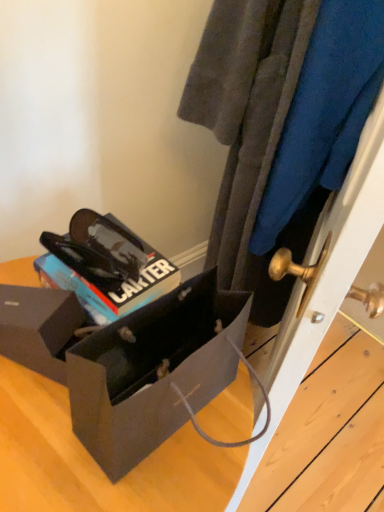
This screenshot has width=384, height=512. Describe the element at coordinates (39, 328) in the screenshot. I see `matte black box at lower left, which is counted as the first box, starting from the back` at that location.

Locate an element on the screen. Image resolution: width=384 pixels, height=512 pixels. matte black box at lower left, the second box when ordered from back to front is located at coordinates (129, 362).

Which is more to the right, matte black box at lower left, arranged as the 1th box when viewed from the front, or glossy black sunglasses at center?

glossy black sunglasses at center is more to the right.

From a real-world perspective, is matte black box at lower left, the second box when ordered from back to front, positioned over glossy black sunglasses at center based on gravity?

No, from a real-world perspective, matte black box at lower left, the second box when ordered from back to front, is not over glossy black sunglasses at center

Does matte black box at lower left, arranged as the 1th box when viewed from the front, turn towards glossy black sunglasses at center?

No, matte black box at lower left, arranged as the 1th box when viewed from the front, is not aimed at glossy black sunglasses at center.

Is there a large distance between matte black box at lower left, arranged as the 1th box when viewed from the front, and glossy black sunglasses at center?

matte black box at lower left, arranged as the 1th box when viewed from the front, is near glossy black sunglasses at center, not far away.

Would you say matte black box at lower left, positioned as the 2th box in front-to-back order, is to the left or to the right of matte black box at lower left, arranged as the 1th box when viewed from the front, in the picture?

Based on their positions, matte black box at lower left, positioned as the 2th box in front-to-back order, is located to the left of matte black box at lower left, arranged as the 1th box when viewed from the front.

Is matte black box at lower left, positioned as the 2th box in front-to-back order, positioned far away from matte black box at lower left, arranged as the 1th box when viewed from the front?

They are positioned close to each other.

Which object is further away from the camera, matte black box at lower left, positioned as the 2th box in front-to-back order, or matte black box at lower left, the second box when ordered from back to front?

matte black box at lower left, positioned as the 2th box in front-to-back order, is further away from the camera.

The width and height of the screenshot is (384, 512). What are the coordinates of `box located underneath the matte black box at lower left, positioned as the 2th box in front-to-back order (from a real-world perspective)` in the screenshot? It's located at (129, 362).

From a real-world perspective, is matte black box at lower left, positioned as the 2th box in front-to-back order, located higher than velvety blue sweater at center?

No.

Between matte black box at lower left, which is counted as the first box, starting from the back, and velvety blue sweater at center, which one appears on the left side from the viewer's perspective?

Positioned to the left is matte black box at lower left, which is counted as the first box, starting from the back.

Looking at this image, is the surface of matte black box at lower left, positioned as the 2th box in front-to-back order, in direct contact with velvety blue sweater at center?

matte black box at lower left, positioned as the 2th box in front-to-back order, and velvety blue sweater at center are clearly separated.

Which of these two, matte black box at lower left, which is counted as the first box, starting from the back, or velvety blue sweater at center, is wider?

Wider between the two is velvety blue sweater at center.

Is matte black box at lower left, which is counted as the first box, starting from the back, turned away from glossy black sunglasses at center?

No, matte black box at lower left, which is counted as the first box, starting from the back,'s orientation is not away from glossy black sunglasses at center.

How far apart are matte black box at lower left, which is counted as the first box, starting from the back, and glossy black sunglasses at center?

matte black box at lower left, which is counted as the first box, starting from the back, and glossy black sunglasses at center are 3.59 inches apart from each other.

From a real-world perspective, is matte black box at lower left, positioned as the 2th box in front-to-back order, above or below glossy black sunglasses at center?

matte black box at lower left, positioned as the 2th box in front-to-back order, is situated lower than glossy black sunglasses at center in the real world.

Considering the relative sizes of matte black box at lower left, which is counted as the first box, starting from the back, and glossy black sunglasses at center in the image provided, is matte black box at lower left, which is counted as the first box, starting from the back, smaller than glossy black sunglasses at center?

Incorrect, matte black box at lower left, which is counted as the first box, starting from the back, is not smaller in size than glossy black sunglasses at center.

Is velvety blue sweater at center closer to camera compared to matte black box at lower left, arranged as the 1th box when viewed from the front?

No, the depth of velvety blue sweater at center is greater than that of matte black box at lower left, arranged as the 1th box when viewed from the front.

Can you confirm if velvety blue sweater at center is bigger than matte black box at lower left, arranged as the 1th box when viewed from the front?

No, velvety blue sweater at center is not bigger than matte black box at lower left, arranged as the 1th box when viewed from the front.

Consider the image. Which is more to the right, velvety blue sweater at center or matte black box at lower left, arranged as the 1th box when viewed from the front?

velvety blue sweater at center is more to the right.

Is velvety blue sweater at center positioned with its back to matte black box at lower left, arranged as the 1th box when viewed from the front?

No, velvety blue sweater at center is not facing the opposite direction of matte black box at lower left, arranged as the 1th box when viewed from the front.

How much distance is there between velvety blue sweater at center and matte black box at lower left, positioned as the 2th box in front-to-back order?

A distance of 19.43 inches exists between velvety blue sweater at center and matte black box at lower left, positioned as the 2th box in front-to-back order.

How many degrees apart are the facing directions of velvety blue sweater at center and matte black box at lower left, which is counted as the first box, starting from the back?

velvety blue sweater at center and matte black box at lower left, which is counted as the first box, starting from the back, are facing 1.92 degrees away from each other.

Is velvety blue sweater at center placed right next to matte black box at lower left, which is counted as the first box, starting from the back?

There is a gap between velvety blue sweater at center and matte black box at lower left, which is counted as the first box, starting from the back.

Does point (285, 50) come in front of point (85, 316)?

No, (285, 50) is further to viewer.

Who is taller, glossy black sunglasses at center or matte black box at lower left, arranged as the 1th box when viewed from the front?

Standing taller between the two is matte black box at lower left, arranged as the 1th box when viewed from the front.

From a real-world perspective, is glossy black sunglasses at center under matte black box at lower left, arranged as the 1th box when viewed from the front?

No.

I want to click on box that is the 2nd object located in front of the glossy black sunglasses at center, so click(x=129, y=362).

This screenshot has width=384, height=512. I want to click on kit positioned vertically above the matte black box at lower left, arranged as the 1th box when viewed from the front (from a real-world perspective), so click(x=107, y=265).

Find the location of a particular element. This screenshot has height=512, width=384. box below the matte black box at lower left, positioned as the 2th box in front-to-back order (from a real-world perspective) is located at coordinates click(x=129, y=362).

Considering their positions, is matte black box at lower left, arranged as the 1th box when viewed from the front, positioned closer to velvety blue sweater at center than glossy black sunglasses at center?

Based on the image, glossy black sunglasses at center appears to be nearer to velvety blue sweater at center.

Looking at the image, which one is located closer to matte black box at lower left, which is counted as the first box, starting from the back, glossy black sunglasses at center or velvety blue sweater at center?

glossy black sunglasses at center is closer to matte black box at lower left, which is counted as the first box, starting from the back.

When comparing their distances from matte black box at lower left, the second box when ordered from back to front, does glossy black sunglasses at center or velvety blue sweater at center seem closer?

glossy black sunglasses at center lies closer to matte black box at lower left, the second box when ordered from back to front, than the other object.

Looking at the image, which one is located further to matte black box at lower left, which is counted as the first box, starting from the back, matte black box at lower left, arranged as the 1th box when viewed from the front, or velvety blue sweater at center?

Result: The object further to matte black box at lower left, which is counted as the first box, starting from the back, is velvety blue sweater at center.

Based on their spatial positions, is velvety blue sweater at center or glossy black sunglasses at center closer to matte black box at lower left, the second box when ordered from back to front?

glossy black sunglasses at center is positioned closer to the anchor matte black box at lower left, the second box when ordered from back to front.

Which object lies nearer to the anchor point velvety blue sweater at center, matte black box at lower left, arranged as the 1th box when viewed from the front, or matte black box at lower left, positioned as the 2th box in front-to-back order?

Based on the image, matte black box at lower left, arranged as the 1th box when viewed from the front, appears to be nearer to velvety blue sweater at center.

Considering their positions, is velvety blue sweater at center positioned further to matte black box at lower left, which is counted as the first box, starting from the back, than matte black box at lower left, arranged as the 1th box when viewed from the front?

velvety blue sweater at center.

In the scene shown: Based on their spatial positions, is matte black box at lower left, positioned as the 2th box in front-to-back order, or matte black box at lower left, arranged as the 1th box when viewed from the front, closer to glossy black sunglasses at center?

Based on the image, matte black box at lower left, positioned as the 2th box in front-to-back order, appears to be nearer to glossy black sunglasses at center.

Image resolution: width=384 pixels, height=512 pixels. In order to click on kit that lies between velvety blue sweater at center and matte black box at lower left, arranged as the 1th box when viewed from the front, from top to bottom in this screenshot , I will do `click(107, 265)`.

The width and height of the screenshot is (384, 512). Identify the location of kit situated between matte black box at lower left, positioned as the 2th box in front-to-back order, and velvety blue sweater at center from left to right. [107, 265].

The height and width of the screenshot is (512, 384). What are the coordinates of `box between velvety blue sweater at center and matte black box at lower left, the second box when ordered from back to front, in the vertical direction` in the screenshot? It's located at (39, 328).

Locate an element on the screen. box between glossy black sunglasses at center and matte black box at lower left, the second box when ordered from back to front, in the up-down direction is located at coordinates (39, 328).